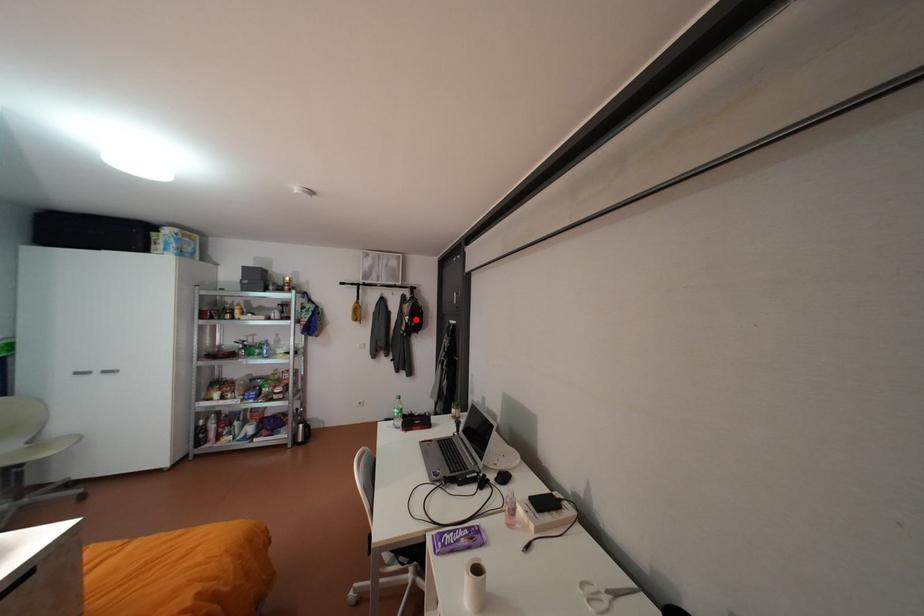
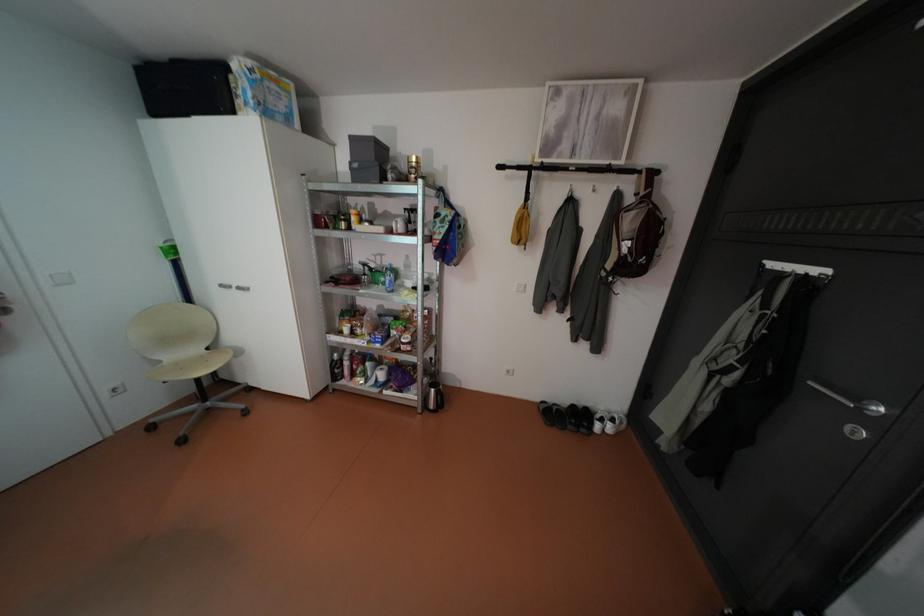
Question: I am providing you with two images of the same scene from different viewpoints. Image1 has a red point marked. In image2, the corresponding 3D location appears at what relative position? Reply with the corresponding letter.

Choices:
 (A) Closer
 (B) Farther

Answer: (A)